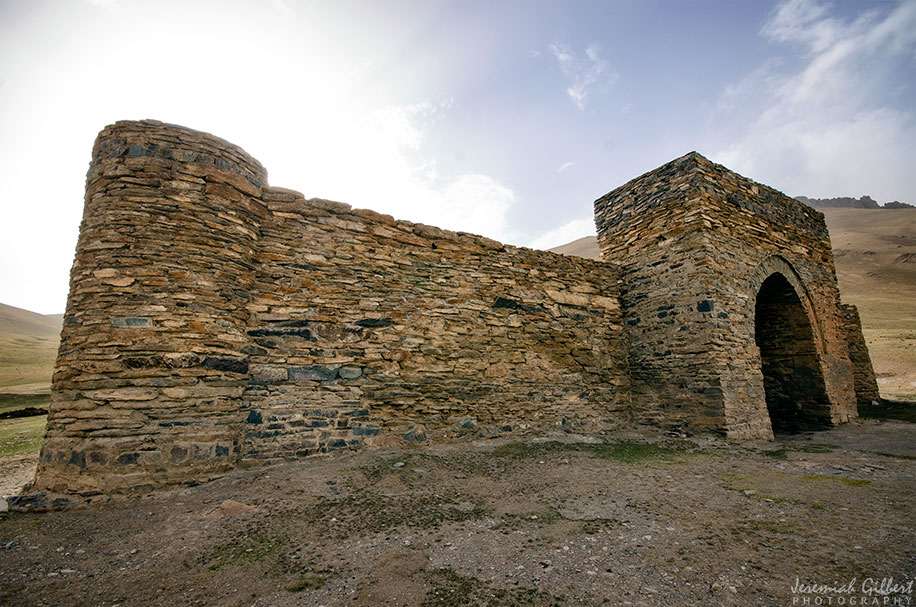
Find the location of `wall`. wall is located at coordinates (363, 370).